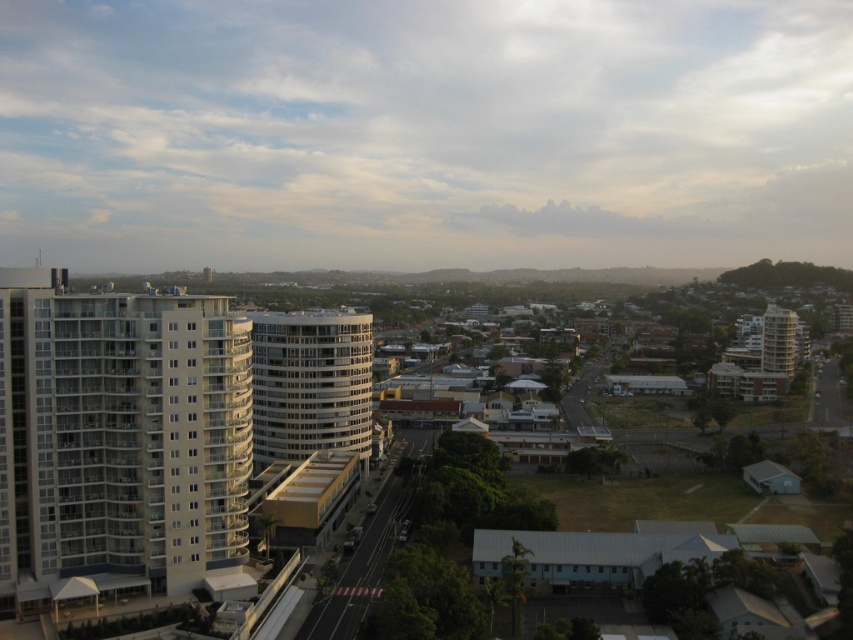
Where is `white glossy building at left`? This screenshot has height=640, width=853. white glossy building at left is located at coordinates (120, 435).

Which is above, white glossy building at left or white glassy building at center?

white glassy building at center

Where is `white glossy building at left`? The width and height of the screenshot is (853, 640). white glossy building at left is located at coordinates (120, 435).

The width and height of the screenshot is (853, 640). In order to click on white glossy building at left in this screenshot , I will do `click(120, 435)`.